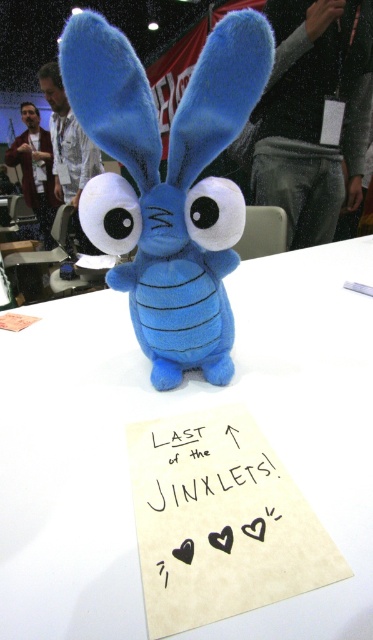
You are at a convention and see a plush toy on a table with a sign. There are two points marked on the table. Which point is closer to you, point (x=352, y=496) or point (x=158, y=426)?

Point (x=352, y=496) is closer to the viewer than point (x=158, y=426).

You are at a convention and see the white matte table at center and the matte blue plush toy at center. Which object is positioned lower in the image?

The white matte table at center is positioned lower than the matte blue plush toy at center.

You are at a convention and see the matte blue plush toy at center and the black paper at center. Which object takes up more horizontal space on the table?

The matte blue plush toy at center has a larger width than the black paper at center, so it takes up more horizontal space on the table.